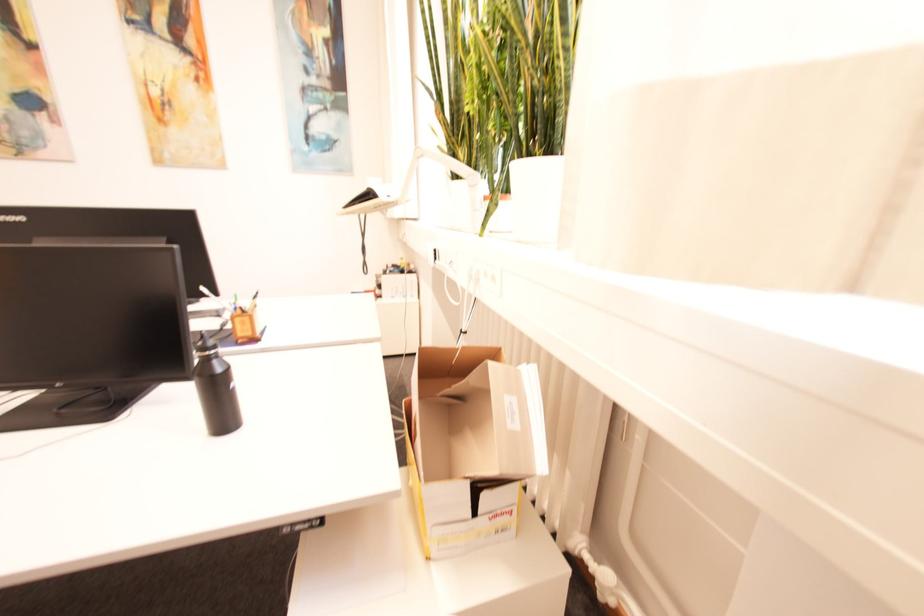
Describe the element at coordinates (370, 208) in the screenshot. I see `the telephone handset` at that location.